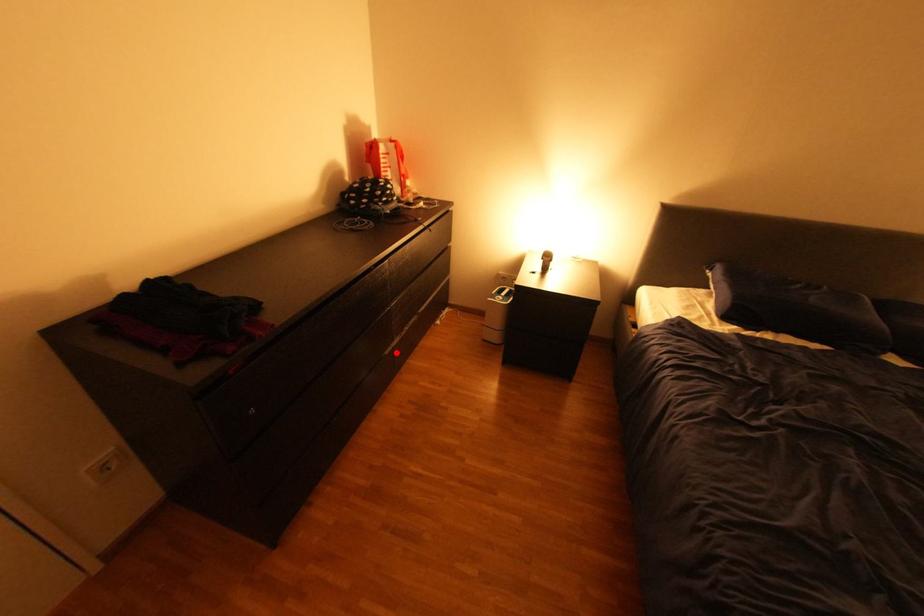
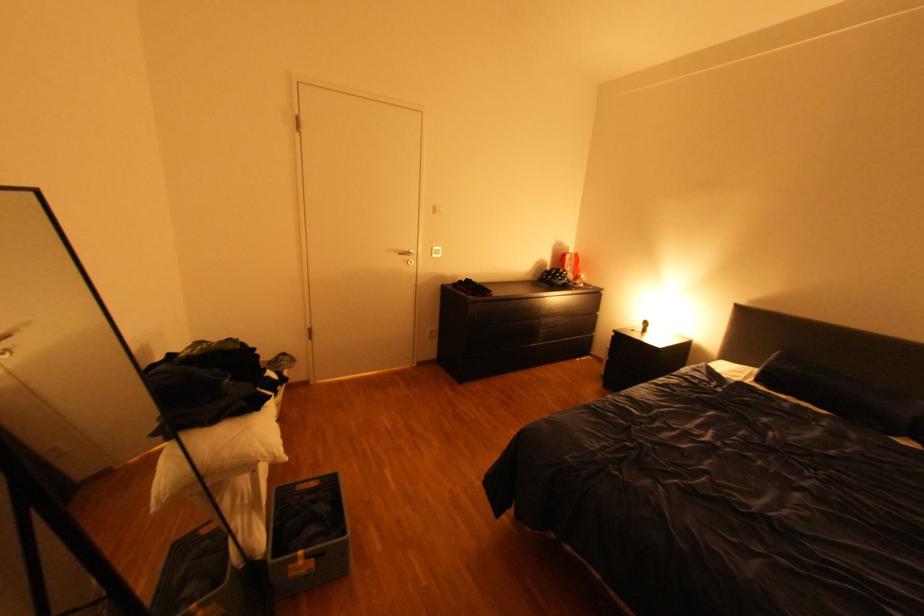
Question: I am providing you with two images of the same scene from different viewpoints. A red point is shown in image1. For the corresponding object point in image2, is it positioned nearer or farther from the camera?

Choices:
 (A) Nearer
 (B) Farther

Answer: (B)